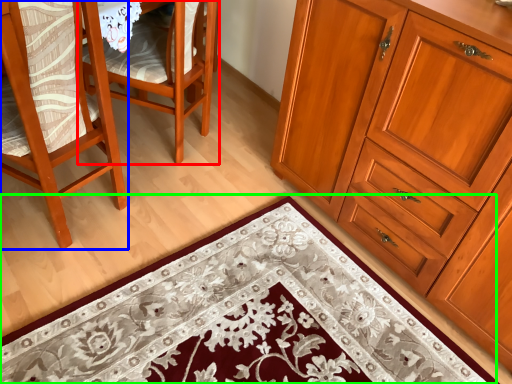
Question: Which object is positioned closest to chair (highlighted by a red box)? Select from chair (highlighted by a blue box) and doormat (highlighted by a green box).

Choices:
 (A) chair
 (B) doormat

Answer: (A)